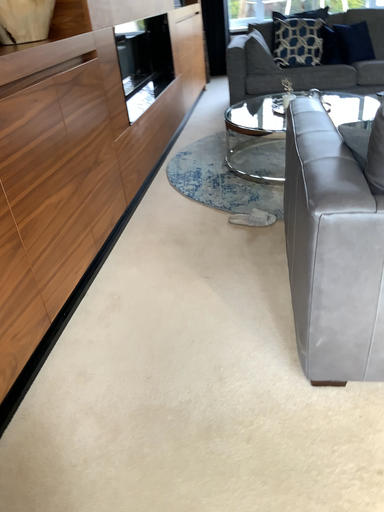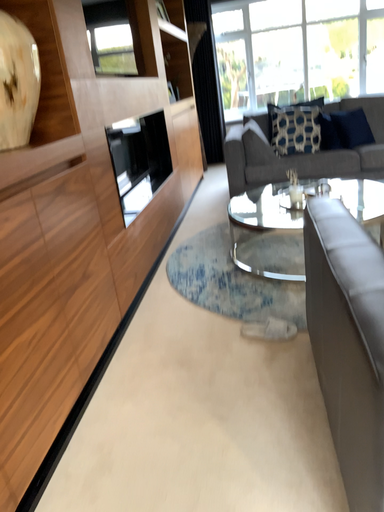
Question: How did the camera likely rotate when shooting the video?

Choices:
 (A) rotated downward
 (B) rotated upward

Answer: (B)